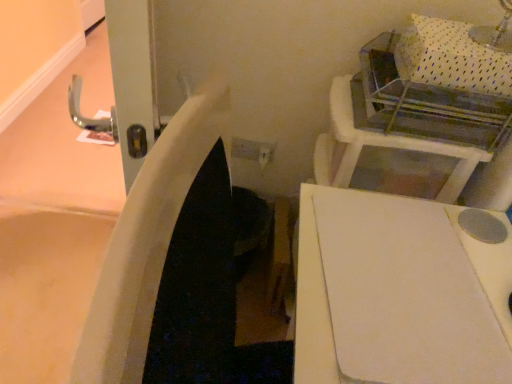
Question: Considering the relative positions of white matte cutting board at center and white plastic vanity at upper right in the image provided, is white matte cutting board at center to the right of white plastic vanity at upper right from the viewer's perspective?

Choices:
 (A) yes
 (B) no

Answer: (B)

Question: From the image's perspective, is white matte cutting board at center located beneath white plastic vanity at upper right?

Choices:
 (A) yes
 (B) no

Answer: (A)

Question: Considering the relative sizes of white matte cutting board at center and white plastic vanity at upper right in the image provided, is white matte cutting board at center shorter than white plastic vanity at upper right?

Choices:
 (A) yes
 (B) no

Answer: (A)

Question: Is white matte cutting board at center directly adjacent to white plastic vanity at upper right?

Choices:
 (A) yes
 (B) no

Answer: (B)

Question: Considering the relative sizes of white matte cutting board at center and white plastic vanity at upper right in the image provided, is white matte cutting board at center smaller than white plastic vanity at upper right?

Choices:
 (A) yes
 (B) no

Answer: (A)

Question: From the image's perspective, is white matte cutting board at center over white plastic vanity at upper right?

Choices:
 (A) yes
 (B) no

Answer: (B)

Question: Does white plastic vanity at upper right have a smaller size compared to white matte cutting board at center?

Choices:
 (A) yes
 (B) no

Answer: (B)

Question: Is white plastic vanity at upper right next to white matte cutting board at center?

Choices:
 (A) no
 (B) yes

Answer: (A)

Question: Is there a large distance between white plastic vanity at upper right and white matte cutting board at center?

Choices:
 (A) no
 (B) yes

Answer: (A)

Question: Considering the relative positions of white plastic vanity at upper right and white matte cutting board at center in the image provided, is white plastic vanity at upper right to the left of white matte cutting board at center from the viewer's perspective?

Choices:
 (A) yes
 (B) no

Answer: (B)

Question: From a real-world perspective, is white plastic vanity at upper right physically below white matte cutting board at center?

Choices:
 (A) no
 (B) yes

Answer: (B)

Question: Is white plastic vanity at upper right at the right side of white matte cutting board at center?

Choices:
 (A) no
 (B) yes

Answer: (B)

Question: Is point (330, 94) positioned closer to the camera than point (499, 347)?

Choices:
 (A) farther
 (B) closer

Answer: (A)